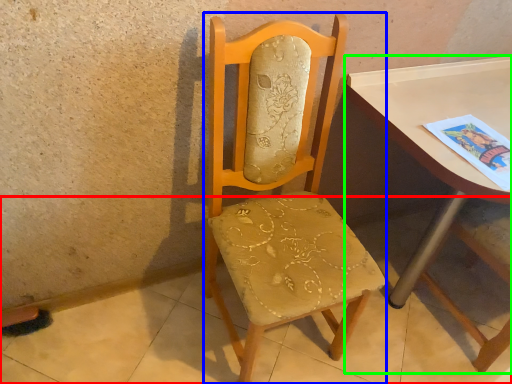
Question: Which is farther away from concrete (highlighted by a red box)? chair (highlighted by a blue box) or table (highlighted by a green box)?

Choices:
 (A) chair
 (B) table

Answer: (B)